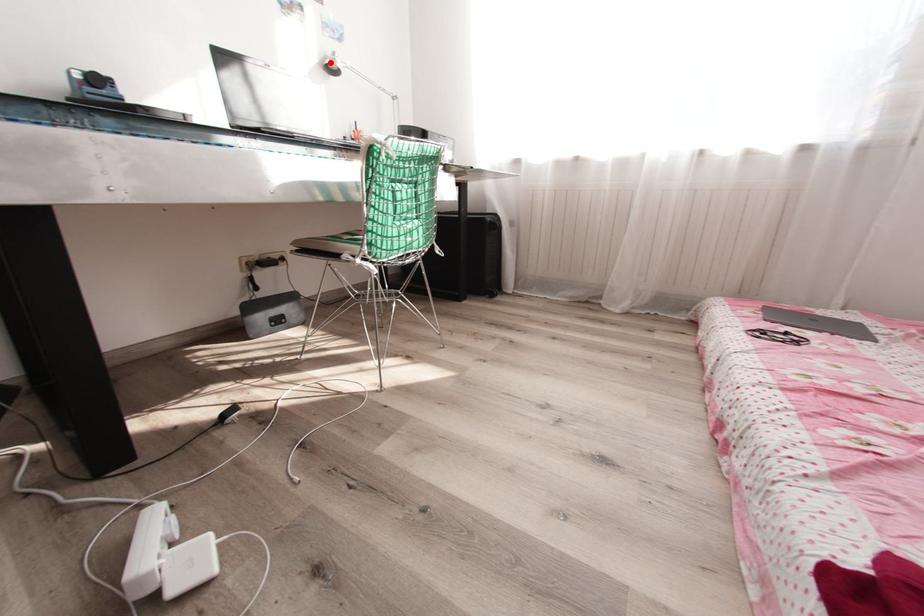
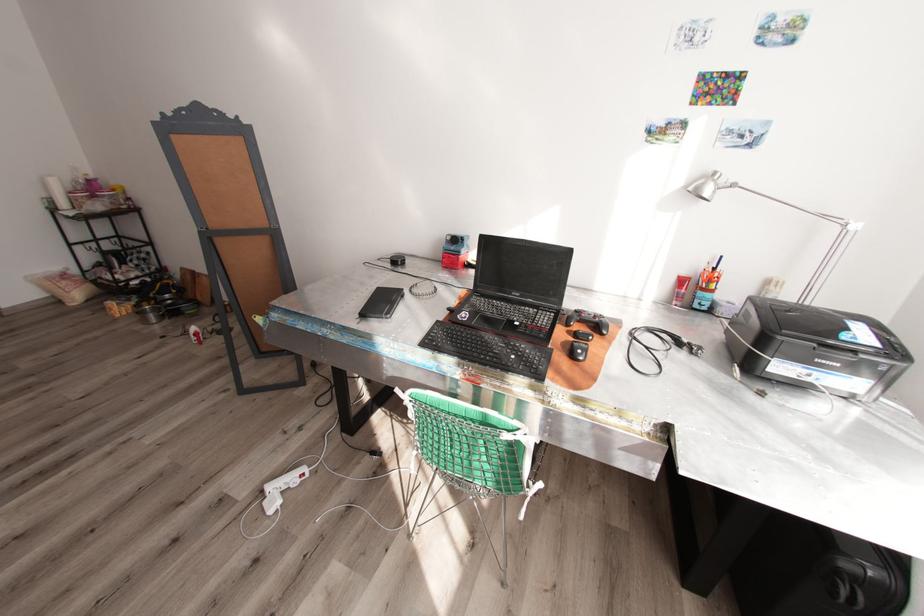
The point at the highlighted location is marked in the first image. Where is the corresponding point in the second image?

(695, 188)